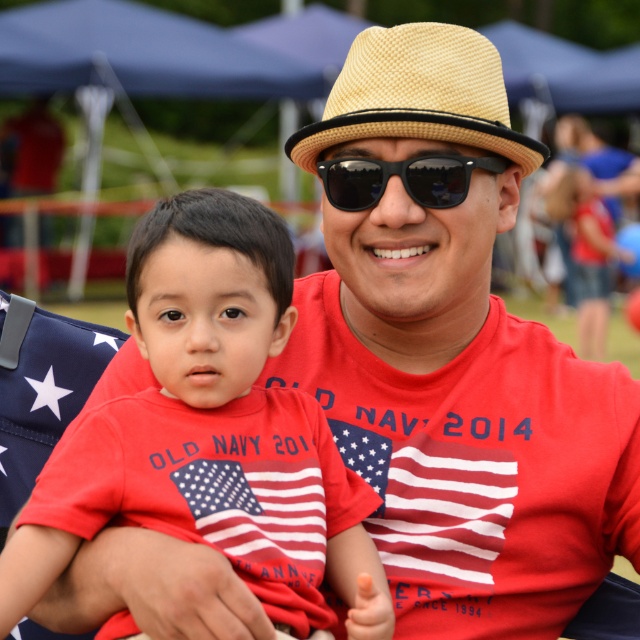
Question: Is beige straw hat at center below american flag fabric at left?

Choices:
 (A) yes
 (B) no

Answer: (B)

Question: Can you confirm if beige straw hat at center is positioned to the left of black reflective sunglasses at center?

Choices:
 (A) yes
 (B) no

Answer: (B)

Question: Which of the following is the farthest from the observer?

Choices:
 (A) (358, 125)
 (B) (385, 177)
 (C) (12, 310)
 (D) (282, 502)

Answer: (C)

Question: Is beige straw hat at center bigger than american flag fabric at left?

Choices:
 (A) no
 (B) yes

Answer: (B)

Question: Which is nearer to the beige straw hat at center?

Choices:
 (A) american flag fabric at left
 (B) black reflective sunglasses at center

Answer: (B)

Question: Which point is farther from the camera taking this photo?

Choices:
 (A) (42, 557)
 (B) (342, 179)
 (C) (60, 346)
 (D) (420, 88)

Answer: (C)